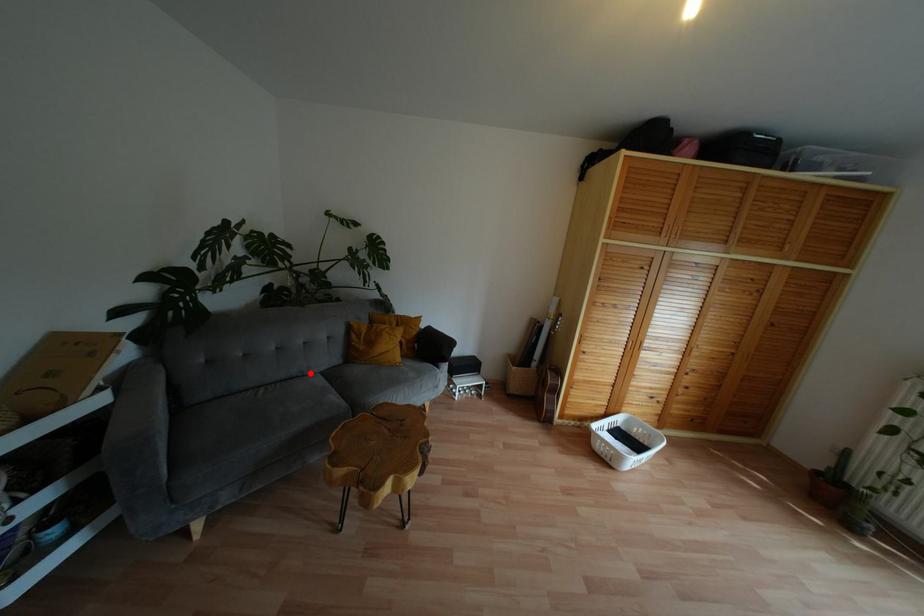
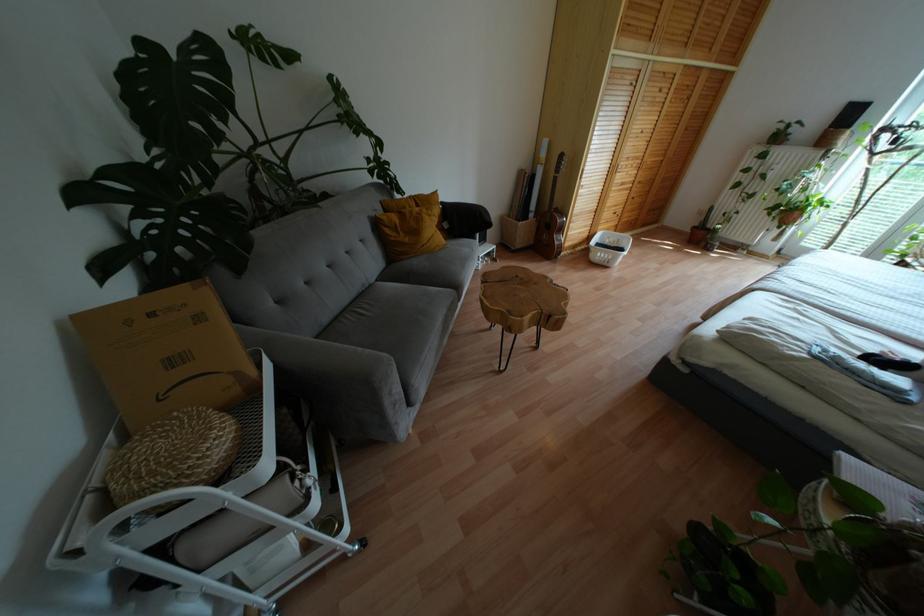
The point at the highlighted location is marked in the first image. Where is the corresponding point in the second image?

(370, 284)